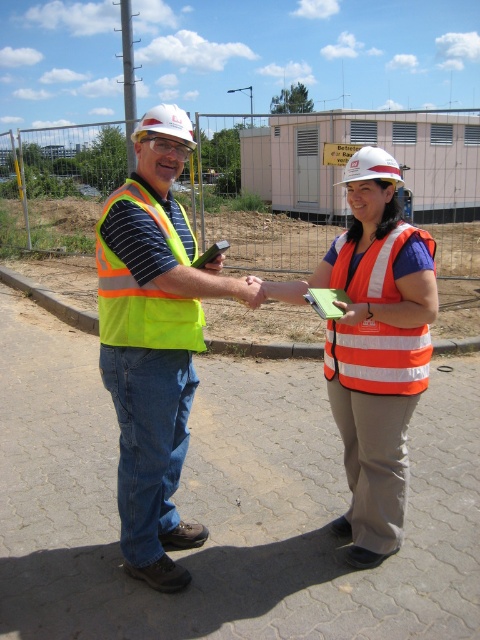
Does neon yellow vest at center appear under high-visibility fabric safety vest at center?

No, neon yellow vest at center is not below high-visibility fabric safety vest at center.

Between neon yellow vest at center and high-visibility fabric safety vest at center, which one appears on the right side from the viewer's perspective?

From the viewer's perspective, high-visibility fabric safety vest at center appears more on the right side.

Who is more forward, (122, 476) or (141, 192)?

Point (141, 192) is more forward.

I want to click on neon yellow vest at center, so click(x=154, y=340).

Is orange reflective vest at center bigger than high-visibility fabric safety vest at center?

Correct, orange reflective vest at center is larger in size than high-visibility fabric safety vest at center.

Which is below, orange reflective vest at center or high-visibility fabric safety vest at center?

orange reflective vest at center

Who is more forward, (368, 413) or (189, 346)?

Point (189, 346) is in front.

You are a GUI agent. You are given a task and a screenshot of the screen. Output one action in this format:
    pyautogui.click(x=<x>, y=<y>)
    Task: Click on the orange reflective vest at center
    Image resolution: width=480 pixels, height=640 pixels.
    Given the screenshot: What is the action you would take?
    pyautogui.click(x=373, y=348)

Can you confirm if orange reflective vest at center is taller than orange reflective safety vest at center?

Indeed, orange reflective vest at center has a greater height compared to orange reflective safety vest at center.

Is orange reflective vest at center shorter than orange reflective safety vest at center?

In fact, orange reflective vest at center may be taller than orange reflective safety vest at center.

Locate an element on the screen. This screenshot has height=640, width=480. orange reflective vest at center is located at coordinates (373, 348).